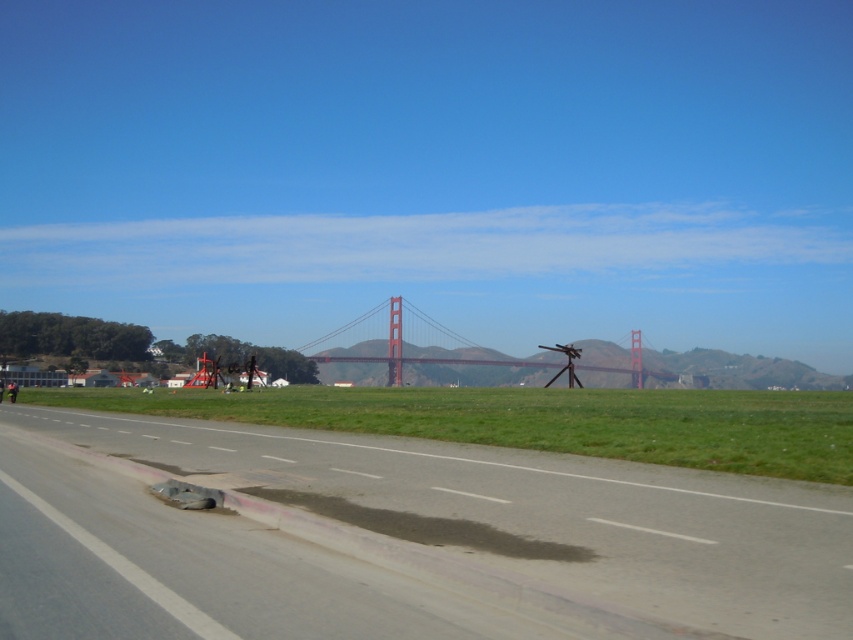
You are a pilot preparing for takeoff. You see the gray asphalt runway at center and the red metallic bridge at center in your view. Which object is closer to you as you look ahead?

The gray asphalt runway at center is closer to you because it is located above the red metallic bridge at center, indicating it is in the foreground of the scene.